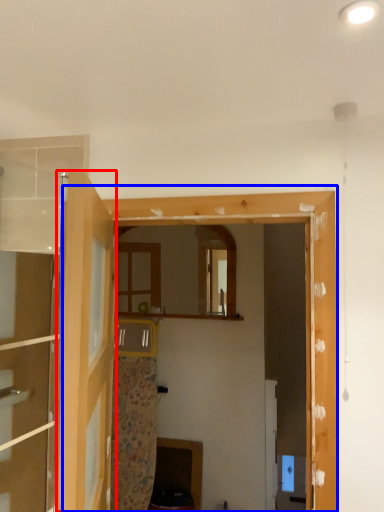
Question: Which object is closer to the camera taking this photo, door (highlighted by a red box) or window frame (highlighted by a blue box)?

Choices:
 (A) door
 (B) window frame

Answer: (A)